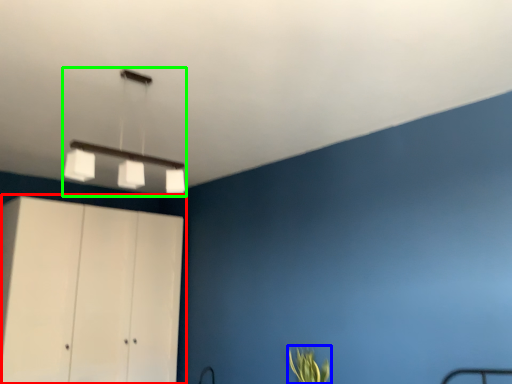
Question: Which is farther away from cupboard (highlighted by a red box)? plant (highlighted by a blue box) or lamp (highlighted by a green box)?

Choices:
 (A) plant
 (B) lamp

Answer: (A)